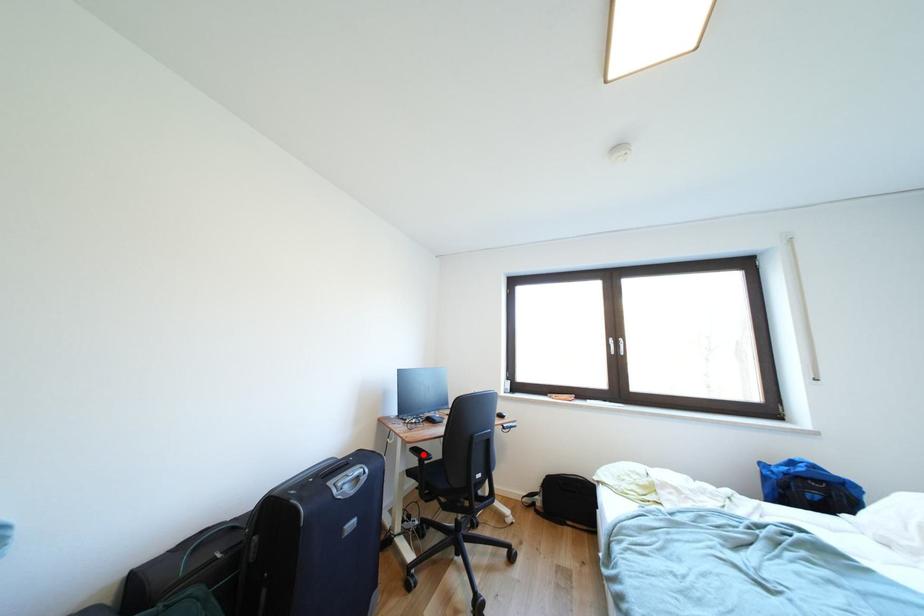
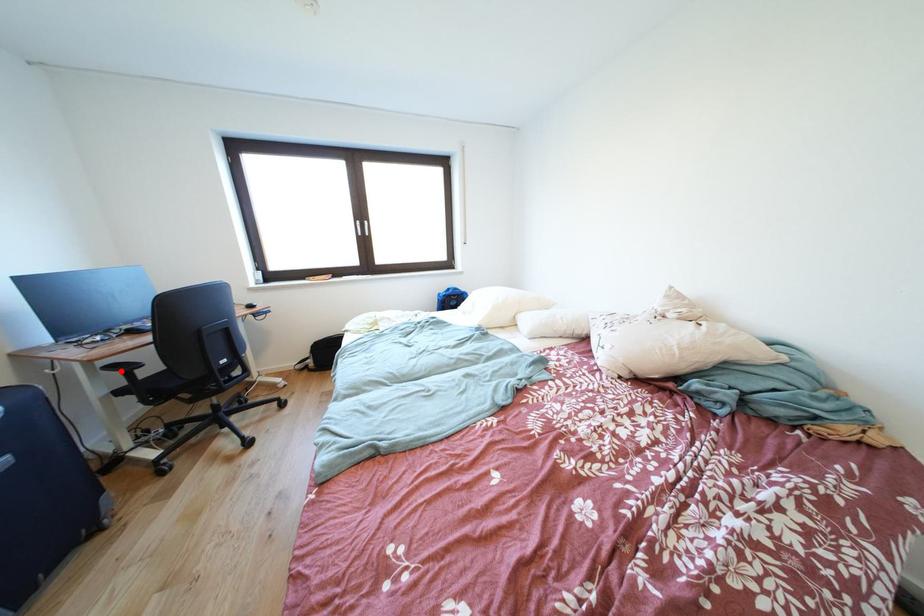
I am providing you with two images of the same scene from different viewpoints. A red point is marked on the first image and another point is marked on the second image. Is the marked point in image1 the same physical position as the marked point in image2?

Yes